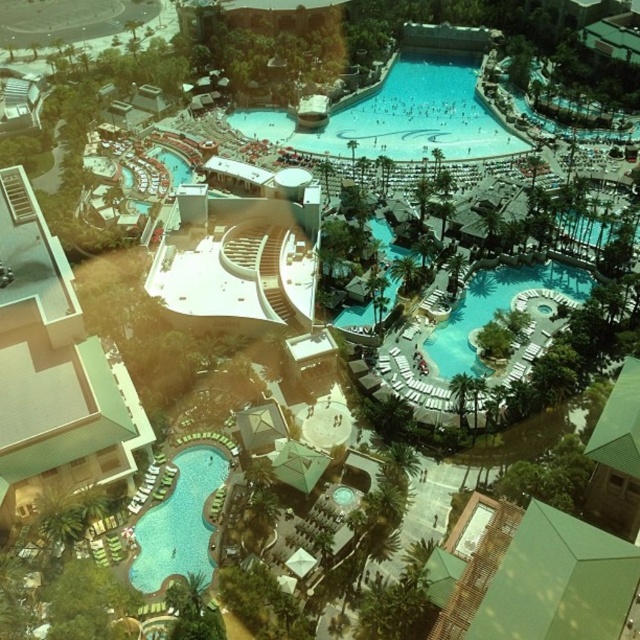
Can you confirm if blue glossy pool at lower left is bigger than shiny blue pool at center right?

Incorrect, blue glossy pool at lower left is not larger than shiny blue pool at center right.

Which is above, blue glossy pool at lower left or shiny blue pool at center right?

shiny blue pool at center right

Who is more distant from viewer, (131, 570) or (452, 333)?

The point (452, 333) is more distant.

Where is `blue glossy pool at lower left`? blue glossy pool at lower left is located at coordinates (179, 522).

Is point (10, 257) less distant than point (310, 148)?

Yes, point (10, 257) is in front of point (310, 148).

Is white concrete building at lower left to the right of clear blue water at center from the viewer's perspective?

Incorrect, white concrete building at lower left is not on the right side of clear blue water at center.

Find the location of a particular element. white concrete building at lower left is located at coordinates (52, 369).

Is clear blue water at center to the left of blue glossy pool at lower left from the viewer's perspective?

No, clear blue water at center is not to the left of blue glossy pool at lower left.

This screenshot has width=640, height=640. What are the coordinates of `clear blue water at center` in the screenshot? It's located at (403, 125).

What are the coordinates of `clear blue water at center` in the screenshot? It's located at (403, 125).